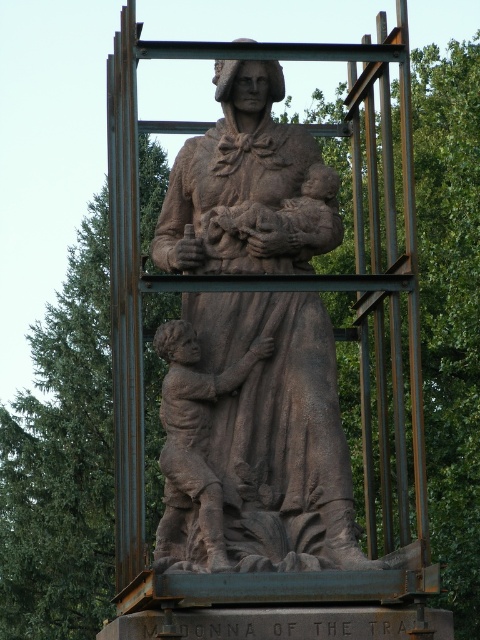
You are standing at the origin point of the image coordinate system, which is the bottom left corner. The statue is enclosed in a metal framework. Where is the brown stone statue at center located in terms of its 2D coordinates?

The brown stone statue at center is located at the 2D coordinates of point (255, 440).

Based on the photo, you are an artist planning to sketch the Madonna of the Trail statue and the child nearby. You need to ensure the proportions are accurate. Which object should you draw first to establish the correct scale, the brown stone statue at center or the brown stone child at lower left?

You should draw the brown stone statue at center first because its width is larger than the brown stone child at lower left, making it the larger object and better for establishing scale.

You are a tour guide explaining the Madonna of the Trail statue to visitors. You mention the brown stone statue at center and the brown stone child at lower left. Which one is bigger?

The brown stone statue at center is larger in size compared to the brown stone child at lower left.